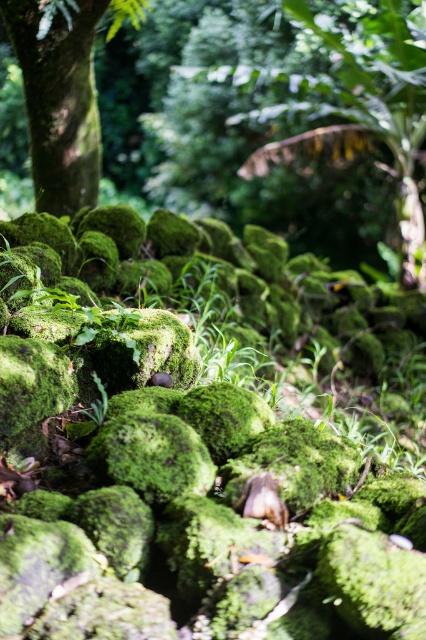
Question: Is green mossy rock at center smaller than green mossy tree trunk at left?

Choices:
 (A) yes
 (B) no

Answer: (B)

Question: Is green mossy rock at center positioned at the back of green mossy tree trunk at left?

Choices:
 (A) yes
 (B) no

Answer: (A)

Question: Among these points, which one is farthest from the camera?

Choices:
 (A) (278, 154)
 (B) (13, 17)

Answer: (A)

Question: Which object appears farthest from the camera in this image?

Choices:
 (A) green mossy rock at center
 (B) green mossy tree trunk at left

Answer: (A)

Question: Can you confirm if green mossy rock at center is smaller than green mossy tree trunk at left?

Choices:
 (A) no
 (B) yes

Answer: (A)